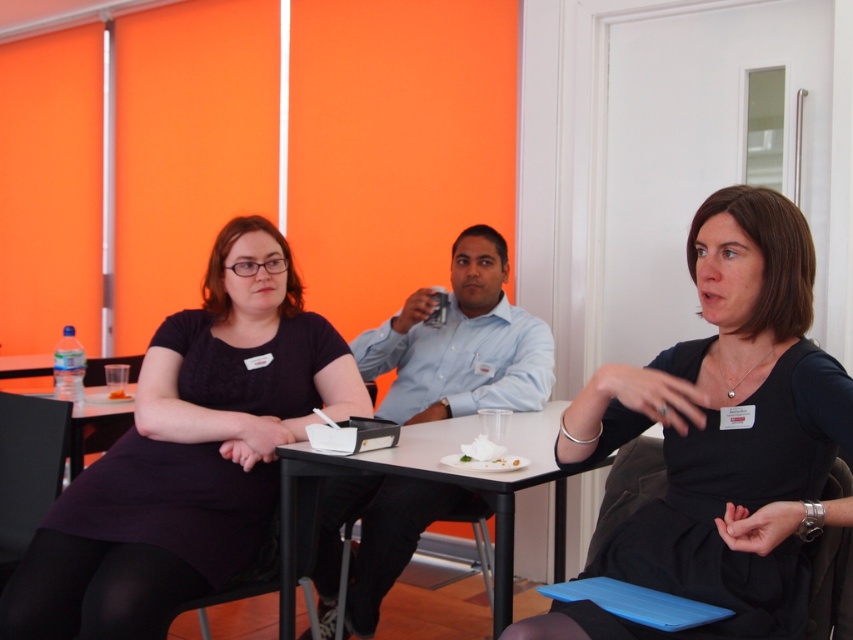
Question: Is matte black dress at left further to the viewer compared to white creamy food at table center?

Choices:
 (A) yes
 (B) no

Answer: (B)

Question: Among these objects, which one is nearest to the camera?

Choices:
 (A) black plastic table at lower left
 (B) matte black dress at left
 (C) black matte dress at center

Answer: (C)

Question: Does matte black dress at left have a lesser width compared to white creamy food at table center?

Choices:
 (A) no
 (B) yes

Answer: (A)

Question: Which point is farther to the camera?

Choices:
 (A) (93, 406)
 (B) (814, 476)

Answer: (A)

Question: Which point is closer to the camera?

Choices:
 (A) (115, 394)
 (B) (727, 230)
 (C) (64, 532)

Answer: (B)

Question: Can you confirm if black matte dress at center is smaller than matte black dress at left?

Choices:
 (A) yes
 (B) no

Answer: (A)